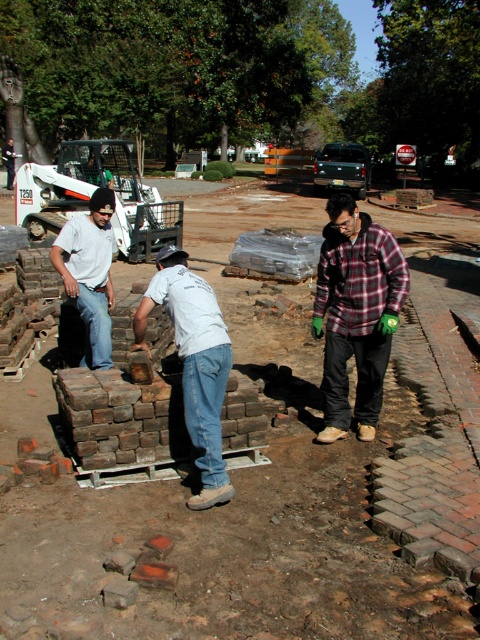
Question: Can you confirm if brown brick wall at center is positioned to the left of white cotton shirt at left?

Choices:
 (A) yes
 (B) no

Answer: (B)

Question: Which of these objects is positioned closest to the white cotton shirt at left?

Choices:
 (A) brown brick wall at center
 (B) light gray jeans at center

Answer: (B)

Question: Which point is closer to the camera taking this photo?

Choices:
 (A) (217, 330)
 (B) (336, 291)
 (C) (66, 252)
 (D) (240, 600)

Answer: (D)

Question: Can you confirm if light gray jeans at center is bigger than white cotton shirt at left?

Choices:
 (A) no
 (B) yes

Answer: (B)

Question: Can you confirm if plaid flannel shirt at center is smaller than light gray jeans at center?

Choices:
 (A) yes
 (B) no

Answer: (B)

Question: Which point appears closest to the camera in this image?

Choices:
 (A) (85, 330)
 (B) (224, 468)
 (C) (348, 408)
 (D) (23, 582)

Answer: (D)